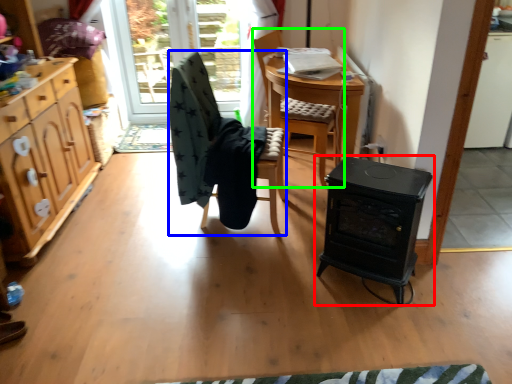
Question: Estimate the real-world distances between objects in this image. Which object is farther from table (highlighted by a red box), chair (highlighted by a blue box) or chair (highlighted by a green box)?

Choices:
 (A) chair
 (B) chair

Answer: (B)